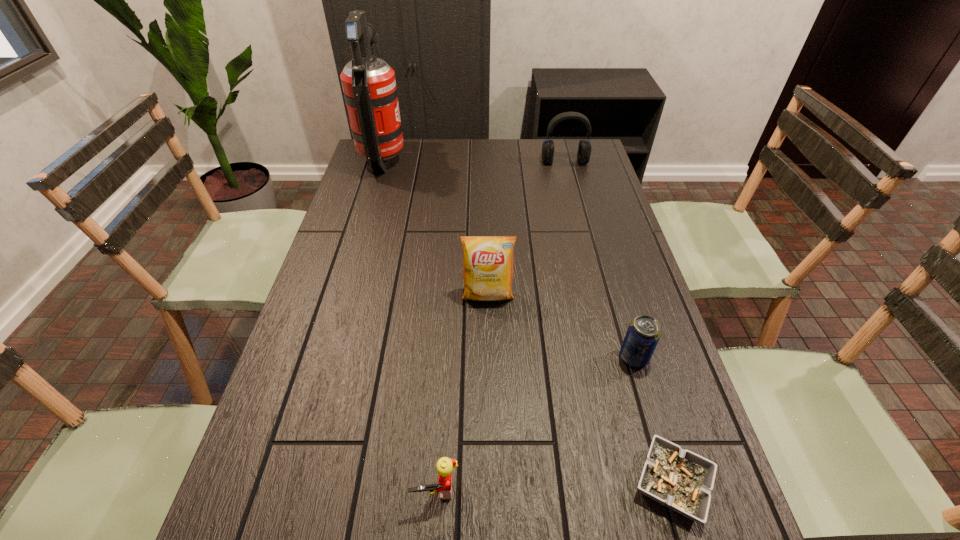
You are a GUI agent. You are given a task and a screenshot of the screen. Output one action in this format:
    pyautogui.click(x=<x>, y=<y>)
    Task: Click on the vacant space at the far edge of the desktop
    
    Given the screenshot: What is the action you would take?
    pyautogui.click(x=490, y=139)

This screenshot has height=540, width=960. Find the location of `vacant space at the left edge of the desktop`. vacant space at the left edge of the desktop is located at coordinates (380, 206).

Identify the location of vacant space at the right edge of the desktop. (581, 252).

I want to click on vacant point located between the headset and the fourth farthest object, so click(x=599, y=260).

Locate an element on the screen. This screenshot has height=540, width=960. vacant region between the crisp (potato chip) and the leftmost object is located at coordinates (436, 227).

This screenshot has height=540, width=960. I want to click on free spot between the fourth nearest object and the Lego, so click(462, 392).

The width and height of the screenshot is (960, 540). What are the coordinates of `vacant space that is in between the Lego and the ashtray` in the screenshot? It's located at (554, 486).

In order to click on unoccupied position between the Lego and the ashtray in this screenshot , I will do coord(554,486).

At what (x,y) coordinates should I click in order to perform the action: click on free spot between the fourth nearest object and the headset. Please return your answer as a coordinate pair (x, y). This screenshot has height=540, width=960. Looking at the image, I should click on (526, 229).

The image size is (960, 540). What are the coordinates of `free point between the third nearest object and the crisp (potato chip)` in the screenshot? It's located at click(561, 327).